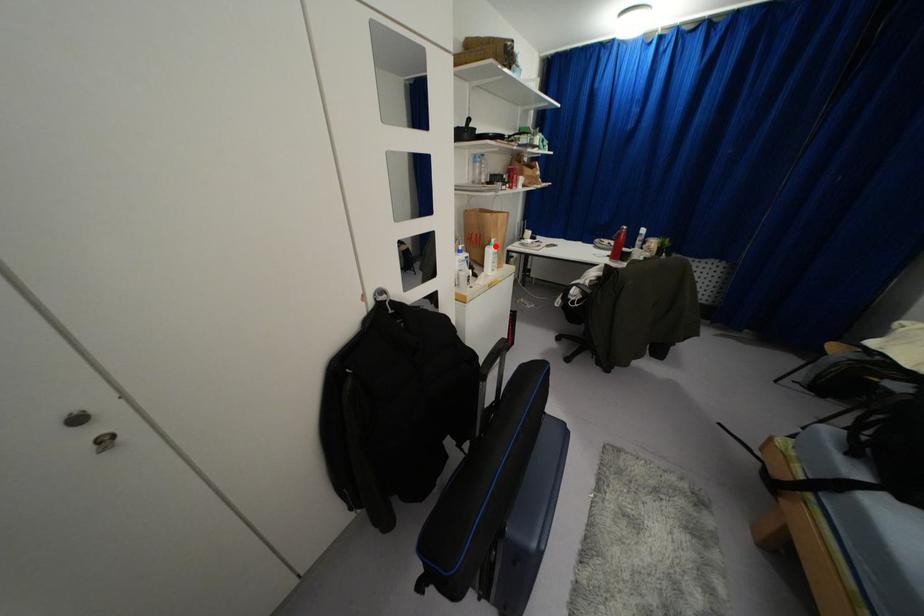
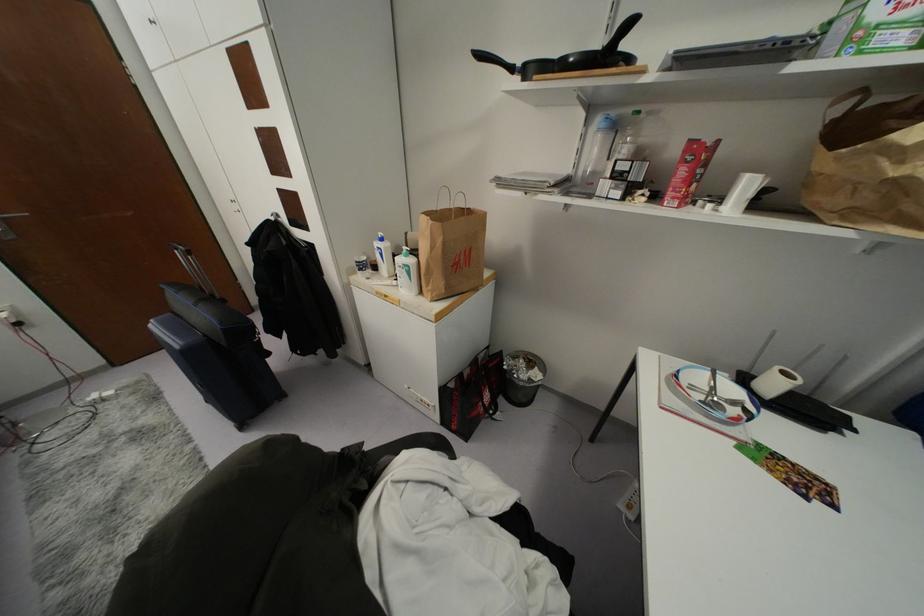
Question: I am providing you with two images of the same scene from different viewpoints. In image1, a red point is highlighted. Considering the same 3D point in image2, which of the following is correct?

Choices:
 (A) It is closer
 (B) It is farther

Answer: (B)